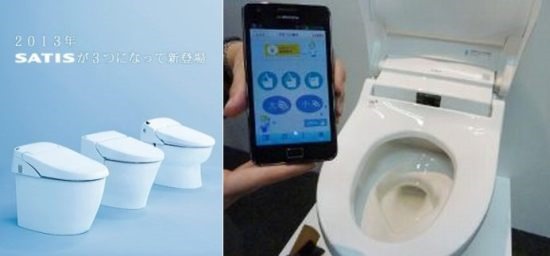
Find the location of `toilets`. toilets is located at coordinates (126, 170), (69, 199), (186, 149), (480, 137).